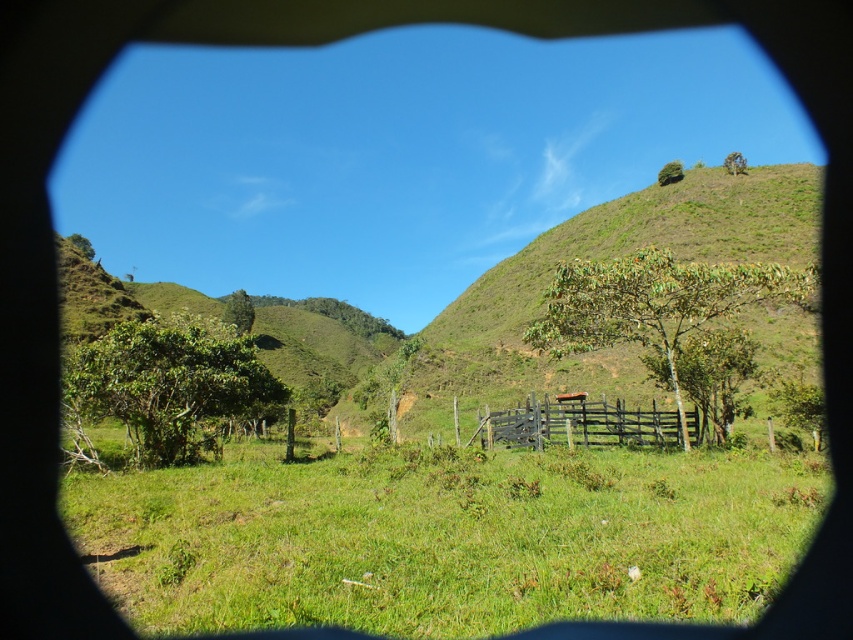
Which is behind, point (682, 454) or point (618, 403)?

The point (618, 403) is behind.

Identify the location of green grassy field at center. (445, 536).